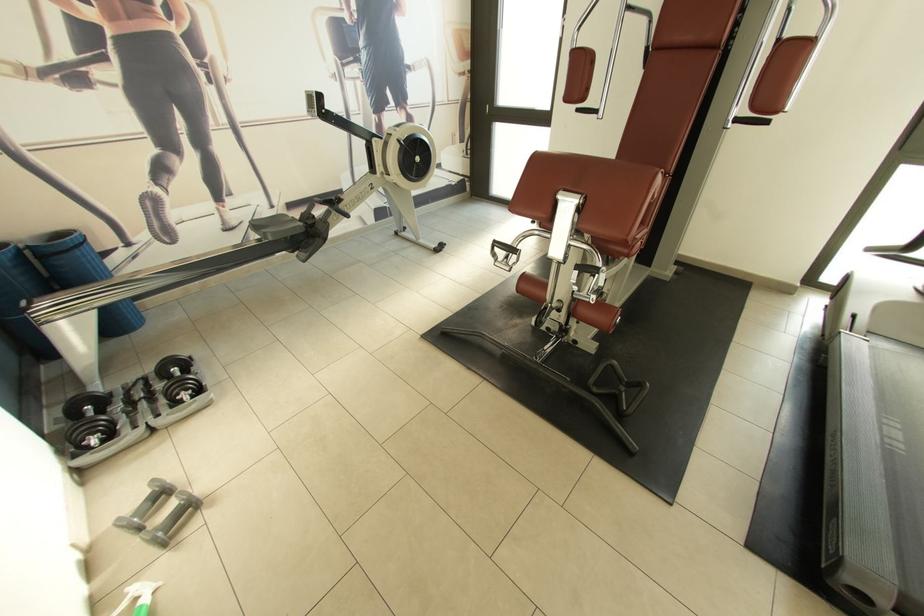
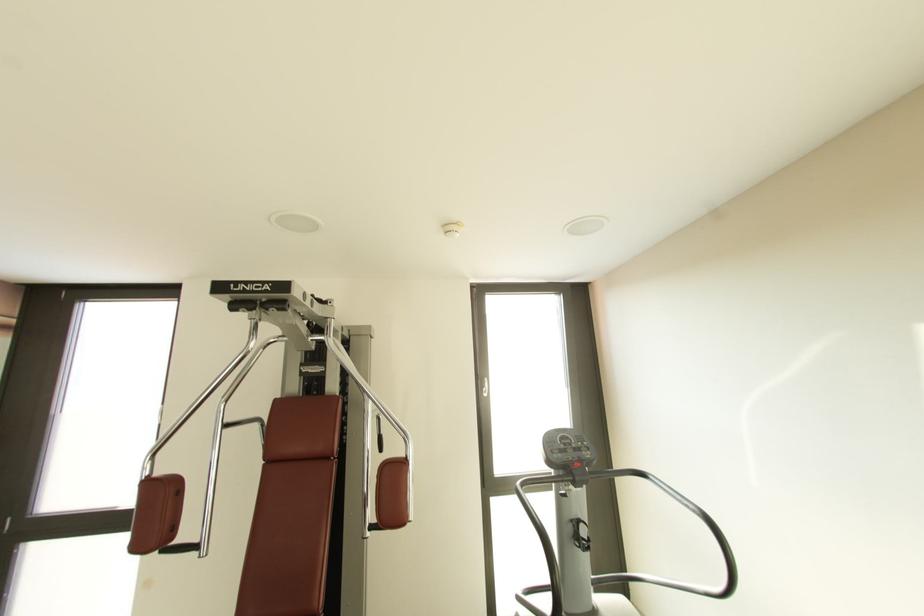
Based on the continuous images, in which direction is the camera rotating?

The camera's rotation is toward right-up.